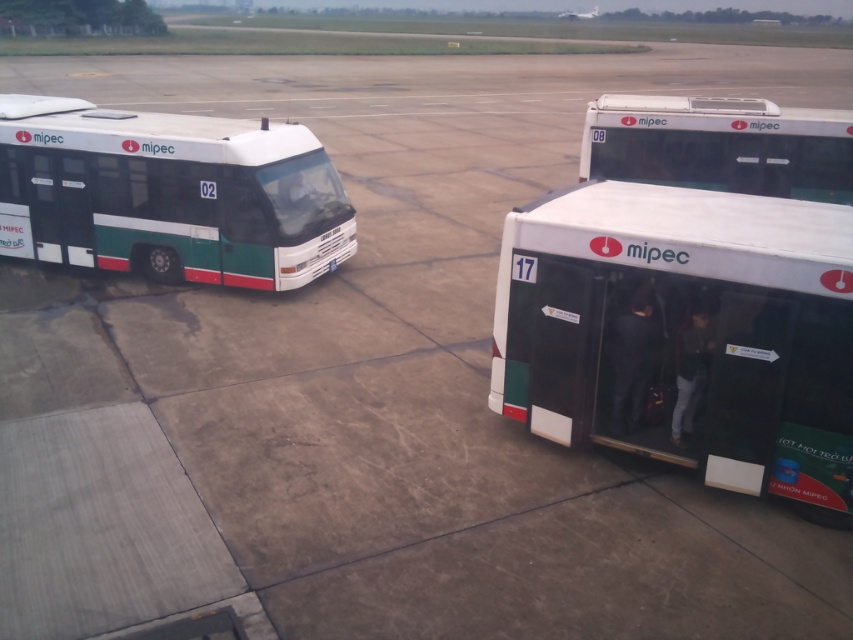
You are standing at the point marked by coordinates point [683,333] in the image. Which object are you directly facing? Please answer with the exact object label from the Objects list.

The point [683,333] marks the white matte bus at right.

You are a maintenance worker needing to park a new bus that is 3 meters wide. The new bus must be parked between the green matte bus at left and the white matte bus at upper right. Given their widths, can the new bus fit in the available space between them?

The green matte bus at left has a lesser width compared to white matte bus at upper right. Since the new bus is 3 meters wide, it depends on the exact space between them. However, since the green bus is narrower, there might be sufficient space if positioned correctly. Without specific distance data, we can only confirm the width comparison, not the exact fit.

You are a passenger trying to board the correct bus. You see two white matte buses in the image. Which one is positioned lower on the image, the white matte bus at right or the white matte bus at upper right?

The white matte bus at right is located below the white matte bus at upper right, so the white matte bus at right is positioned lower on the image.